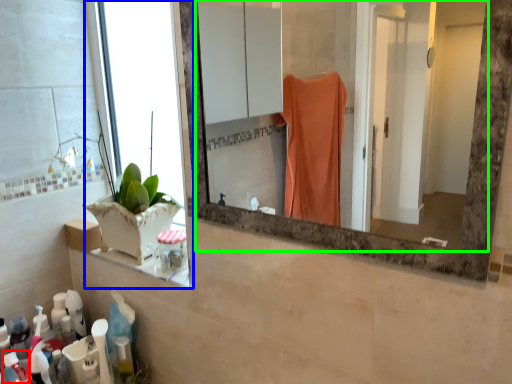
Question: Which object is positioned farthest from toiletry (highlighted by a red box)? Select from window (highlighted by a blue box) and mirror (highlighted by a green box).

Choices:
 (A) window
 (B) mirror

Answer: (B)